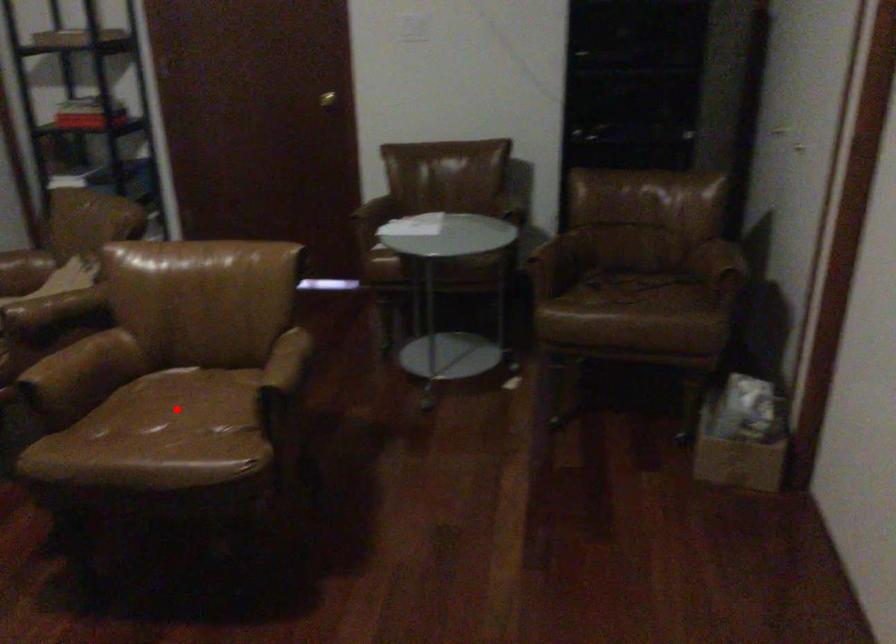
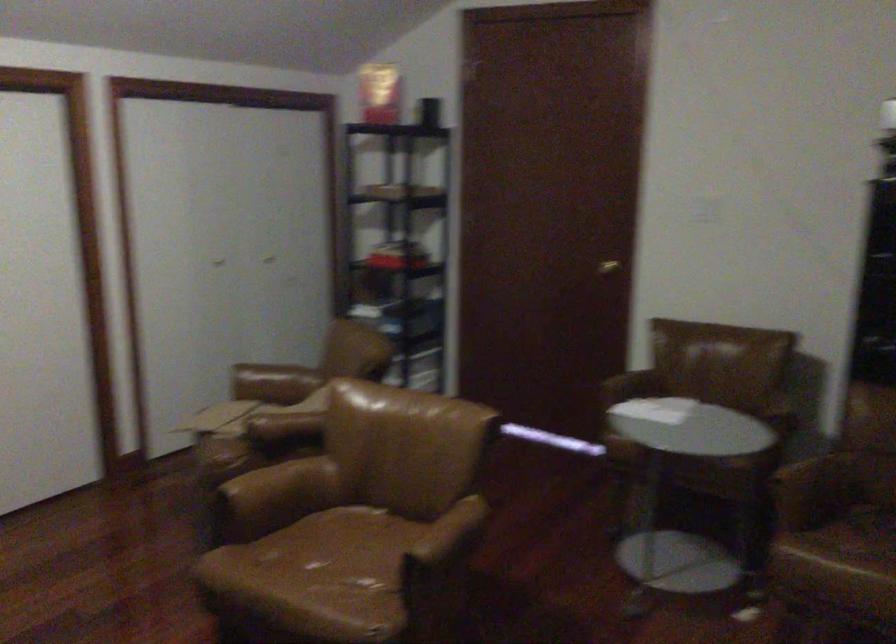
In the second image, find the point that corresponds to the highlighted location in the first image.

(343, 556)